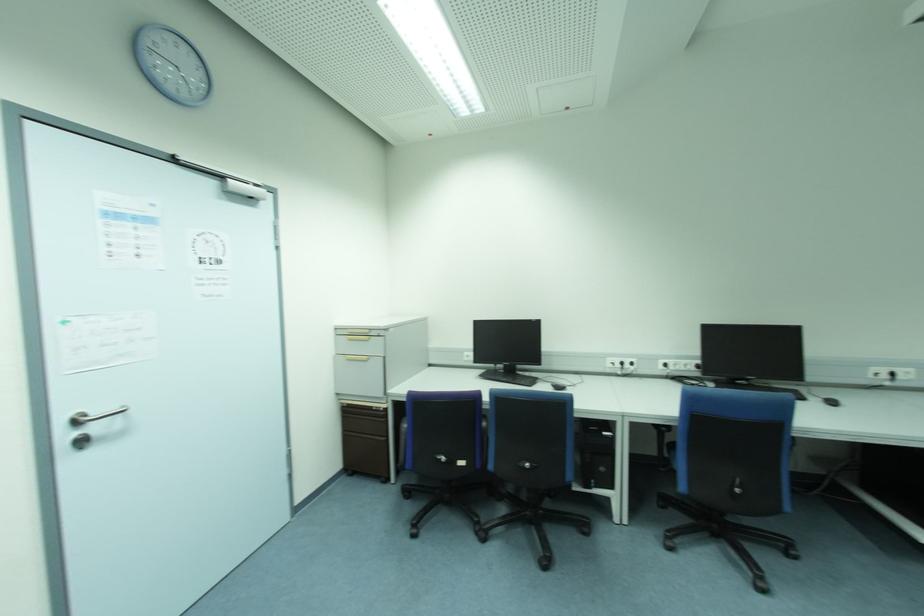
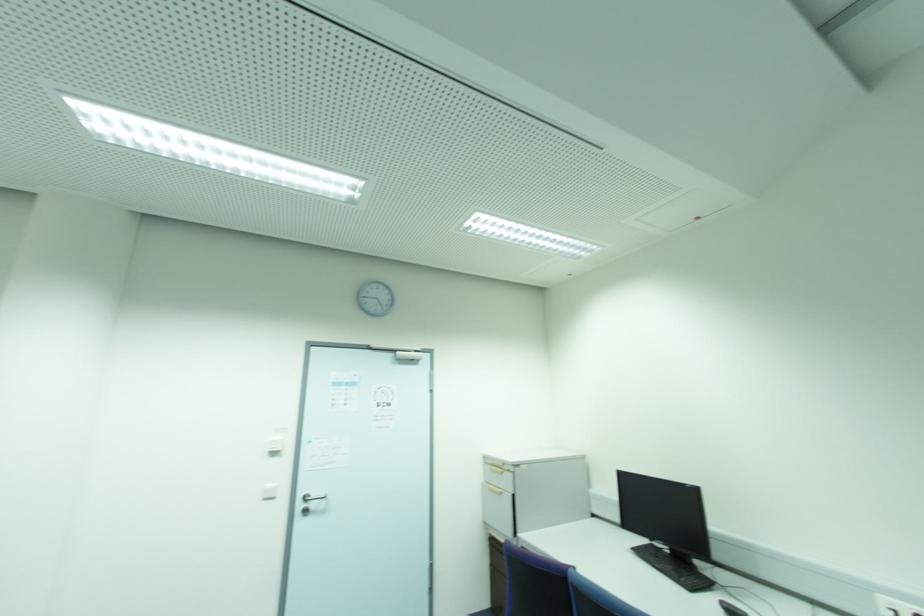
Locate, in the second image, the point that corresponds to [370,359] in the first image.

(502, 493)